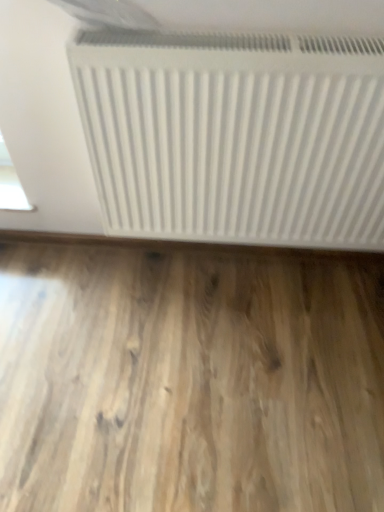
Question: Considering the relative positions of white matte radiator at upper center and light brown wood flooring at bottom in the image provided, is white matte radiator at upper center to the left of light brown wood flooring at bottom from the viewer's perspective?

Choices:
 (A) no
 (B) yes

Answer: (A)

Question: Considering the relative sizes of white matte radiator at upper center and light brown wood flooring at bottom in the image provided, is white matte radiator at upper center shorter than light brown wood flooring at bottom?

Choices:
 (A) yes
 (B) no

Answer: (B)

Question: Does white matte radiator at upper center lie behind light brown wood flooring at bottom?

Choices:
 (A) no
 (B) yes

Answer: (A)

Question: Considering the relative sizes of white matte radiator at upper center and light brown wood flooring at bottom in the image provided, is white matte radiator at upper center taller than light brown wood flooring at bottom?

Choices:
 (A) yes
 (B) no

Answer: (A)

Question: From the image's perspective, is white matte radiator at upper center over light brown wood flooring at bottom?

Choices:
 (A) yes
 (B) no

Answer: (A)

Question: Can you confirm if white matte radiator at upper center is bigger than light brown wood flooring at bottom?

Choices:
 (A) no
 (B) yes

Answer: (B)

Question: From a real-world perspective, is light brown wood flooring at bottom on white matte radiator at upper center?

Choices:
 (A) no
 (B) yes

Answer: (A)

Question: Is light brown wood flooring at bottom next to white matte radiator at upper center and touching it?

Choices:
 (A) no
 (B) yes

Answer: (A)

Question: Is light brown wood flooring at bottom shorter than white matte radiator at upper center?

Choices:
 (A) yes
 (B) no

Answer: (A)

Question: Considering the relative positions of light brown wood flooring at bottom and white matte radiator at upper center in the image provided, is light brown wood flooring at bottom to the left of white matte radiator at upper center from the viewer's perspective?

Choices:
 (A) no
 (B) yes

Answer: (B)

Question: From a real-world perspective, is light brown wood flooring at bottom located beneath white matte radiator at upper center?

Choices:
 (A) yes
 (B) no

Answer: (A)

Question: Is light brown wood flooring at bottom located outside white matte radiator at upper center?

Choices:
 (A) no
 (B) yes

Answer: (B)

Question: Is light brown wood flooring at bottom to the left or to the right of white matte radiator at upper center in the image?

Choices:
 (A) left
 (B) right

Answer: (A)